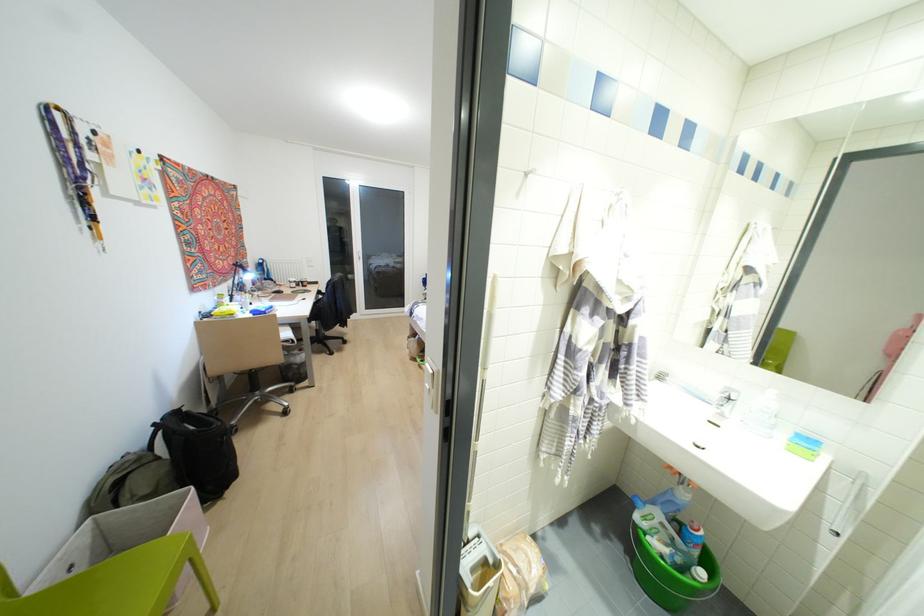
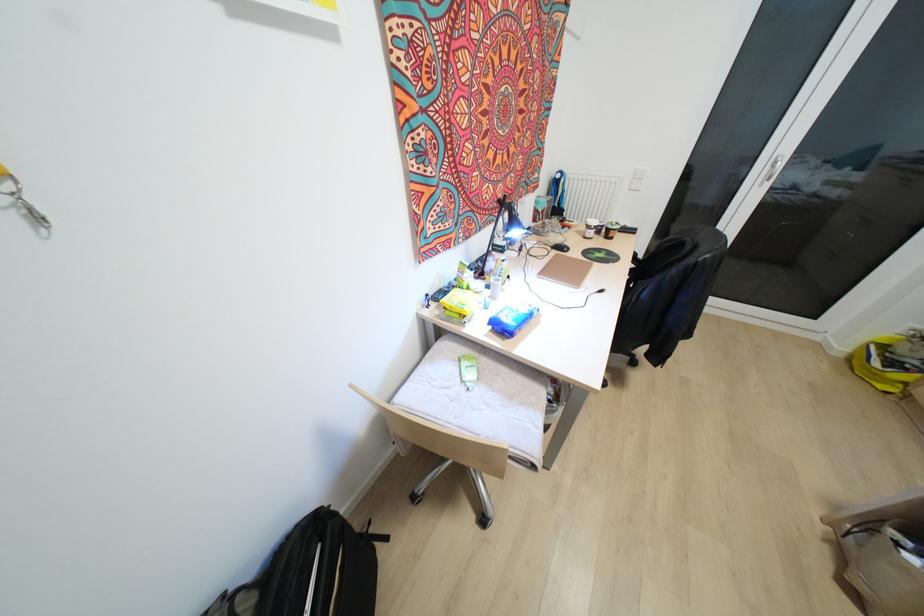
In the second image, find the point that corresponds to (x=292, y=278) in the first image.

(592, 222)